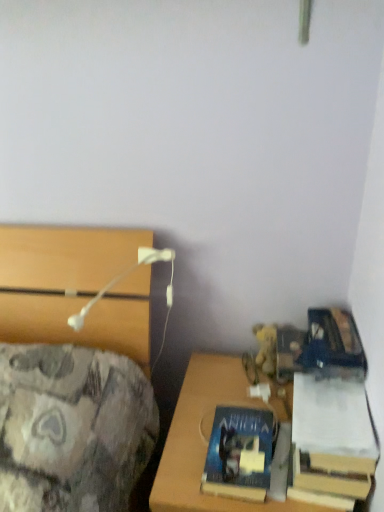
At what (x,y) coordinates should I click in order to perform the action: click on blank space above blue matte book at lower right, which ranks as the 2th book in right-to-left order (from a real-world perspective). Please return your answer as a coordinate pair (x, y). Looking at the image, I should click on (240, 448).